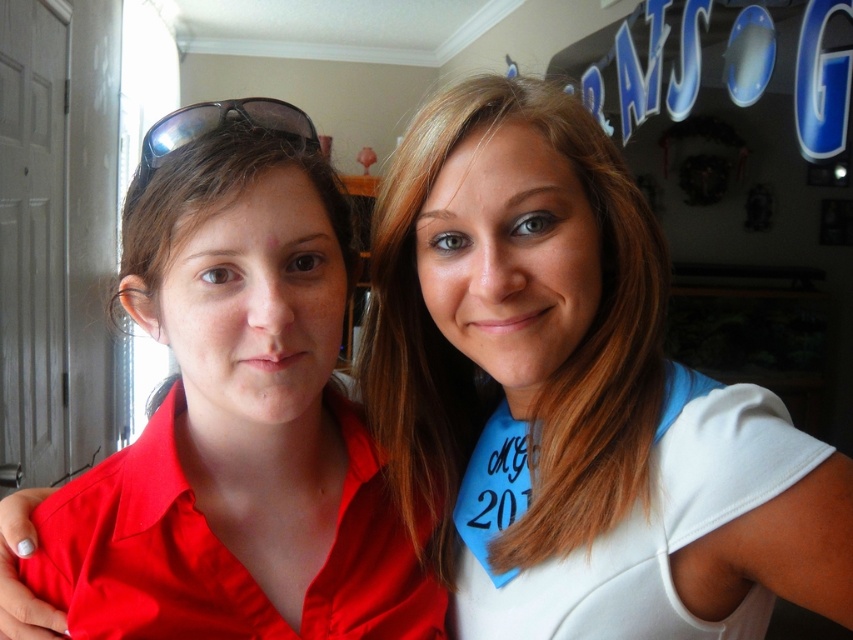
Find the location of a particular element. matte red shirt at left is located at coordinates (241, 420).

Measure the distance between point (218, 205) and camera.

Point (218, 205) is 21.19 inches away from camera.

Identify the location of matte red shirt at left. (241, 420).

The height and width of the screenshot is (640, 853). I want to click on white matte shirt at upper right, so click(x=570, y=392).

Can you confirm if white matte shirt at upper right is bigger than sunglasses at left?

Indeed, white matte shirt at upper right has a larger size compared to sunglasses at left.

Which is in front, point (492, 608) or point (173, 141)?

Positioned in front is point (173, 141).

The height and width of the screenshot is (640, 853). I want to click on white matte shirt at upper right, so click(x=570, y=392).

Which is above, white matte shirt at upper right or matte red shirt at left?

Positioned higher is white matte shirt at upper right.

Which is behind, point (492, 372) or point (305, 134)?

Positioned behind is point (305, 134).

What are the coordinates of `white matte shirt at upper right` in the screenshot? It's located at (570, 392).